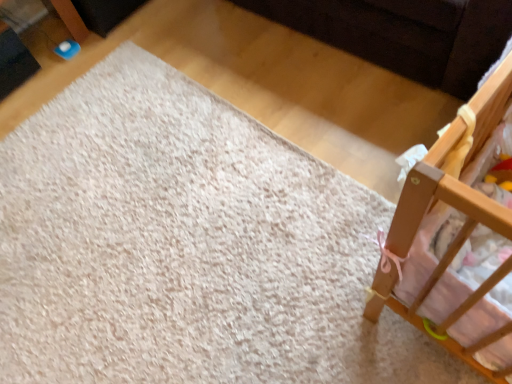
The image size is (512, 384). Describe the element at coordinates (424, 215) in the screenshot. I see `wooden crib at right` at that location.

The width and height of the screenshot is (512, 384). I want to click on wooden crib at right, so (424, 215).

Image resolution: width=512 pixels, height=384 pixels. What do you see at coordinates (181, 244) in the screenshot?
I see `white soft carpet at upper left` at bounding box center [181, 244].

Locate an element on the screen. The image size is (512, 384). white soft carpet at upper left is located at coordinates (181, 244).

The image size is (512, 384). I want to click on wooden crib at right, so click(424, 215).

Does white soft carpet at upper left appear on the right side of wooden crib at right?

Incorrect, white soft carpet at upper left is not on the right side of wooden crib at right.

Is white soft carpet at upper left positioned in front of wooden crib at right?

That is False.

Which point is more distant from viewer, (123, 187) or (470, 356)?

The point (123, 187) is behind.

From the image's perspective, which one is positioned higher, white soft carpet at upper left or wooden crib at right?

wooden crib at right is shown above in the image.

From a real-world perspective, is white soft carpet at upper left physically above wooden crib at right?

No, from a real-world perspective, white soft carpet at upper left is not over wooden crib at right

Considering the sizes of objects white soft carpet at upper left and wooden crib at right in the image provided, who is wider, white soft carpet at upper left or wooden crib at right?

white soft carpet at upper left.

Which of these two, white soft carpet at upper left or wooden crib at right, stands shorter?

white soft carpet at upper left is shorter.

Is white soft carpet at upper left bigger than wooden crib at right?

No.

Is wooden crib at right inside white soft carpet at upper left?

No, wooden crib at right is located outside of white soft carpet at upper left.

Are white soft carpet at upper left and wooden crib at right located far from each other?

No, white soft carpet at upper left is in close proximity to wooden crib at right.

Is white soft carpet at upper left aimed at wooden crib at right?

No.

How many degrees apart are the facing directions of white soft carpet at upper left and wooden crib at right?

89.9 degrees separate the facing orientations of white soft carpet at upper left and wooden crib at right.

Measure the distance from white soft carpet at upper left to wooden crib at right.

31.79 inches.

I want to click on infant bed in front of the white soft carpet at upper left, so [x=424, y=215].

Which object is positioned more to the right, wooden crib at right or white soft carpet at upper left?

wooden crib at right.

Does wooden crib at right lie behind white soft carpet at upper left?

No, it is in front of white soft carpet at upper left.

Does point (405, 225) lie in front of point (73, 261)?

That is True.

From the image's perspective, does wooden crib at right appear lower than white soft carpet at upper left?

No, from the image's perspective, wooden crib at right is not below white soft carpet at upper left.

Consider the image. From a real-world perspective, which is physically below, wooden crib at right or white soft carpet at upper left?

white soft carpet at upper left, from a real-world perspective.

Is wooden crib at right wider than white soft carpet at upper left?

No.

Which of these two, wooden crib at right or white soft carpet at upper left, stands taller?

wooden crib at right.

Between wooden crib at right and white soft carpet at upper left, which one has larger size?

wooden crib at right is bigger.

Is wooden crib at right spatially inside white soft carpet at upper left, or outside of it?

wooden crib at right exists outside the volume of white soft carpet at upper left.

Is wooden crib at right touching white soft carpet at upper left?

wooden crib at right is not next to white soft carpet at upper left, and they're not touching.

Is wooden crib at right facing towards white soft carpet at upper left?

No.

You are a GUI agent. You are given a task and a screenshot of the screen. Output one action in this format:
    pyautogui.click(x=<x>, y=<y>)
    Task: Click on the mat that appears below the wooden crib at right (from the image's perspective)
    The image size is (512, 384).
    Given the screenshot: What is the action you would take?
    pyautogui.click(x=181, y=244)

Locate an element on the screen. mat that appears below the wooden crib at right (from the image's perspective) is located at coordinates (181, 244).

Identify the location of mat behind the wooden crib at right. (181, 244).